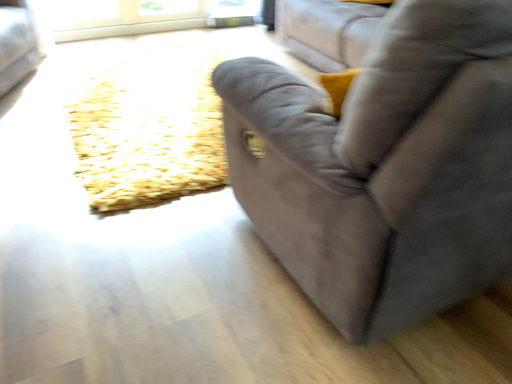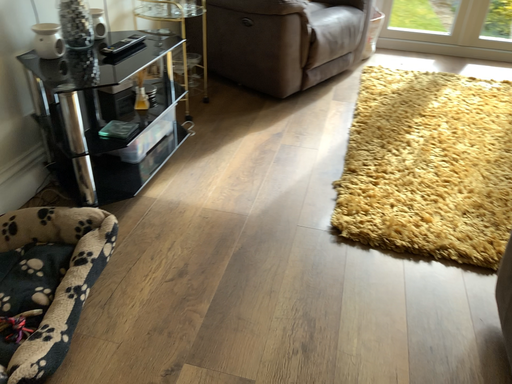
Question: How did the camera likely rotate when shooting the video?

Choices:
 (A) rotated right
 (B) rotated left

Answer: (B)